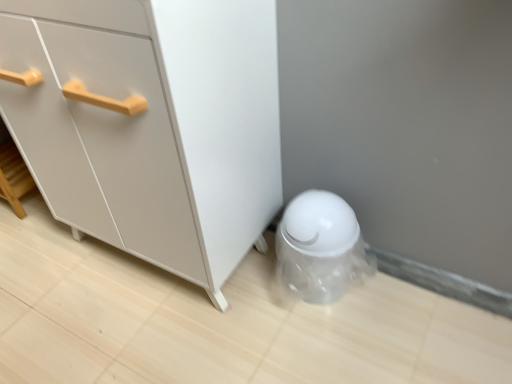
Locate an element on the screen. Image resolution: width=512 pixels, height=384 pixels. free space in front of white matte cabinet at center is located at coordinates (172, 346).